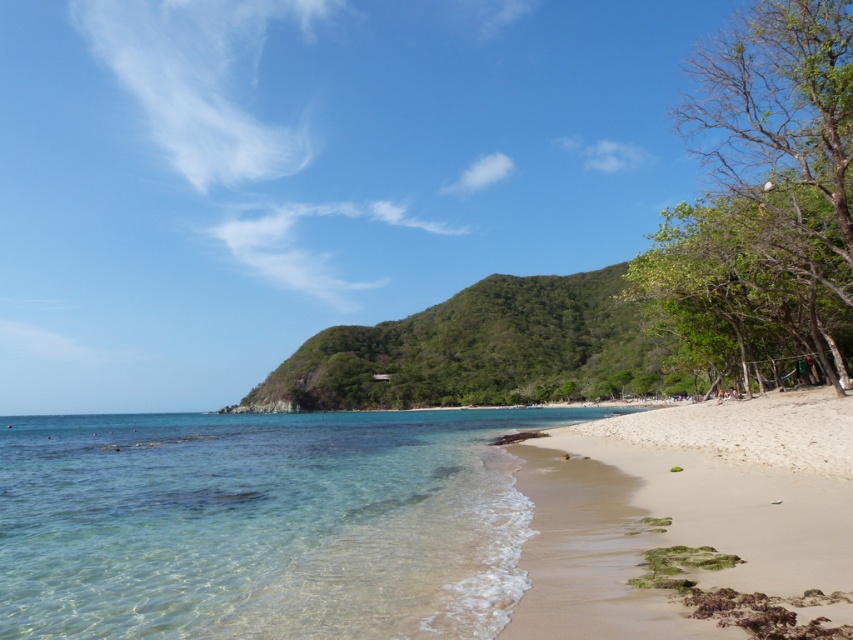
Question: Which object appears farthest from the camera in this image?

Choices:
 (A) white sandy beach at lower right
 (B) sandy beach at lower right

Answer: (A)

Question: Which point appears closest to the camera in this image?

Choices:
 (A) (653, 435)
 (B) (593, 560)
 (C) (383, 436)

Answer: (B)

Question: Which object is farther from the camera taking this photo?

Choices:
 (A) clear water at lower left
 (B) sandy beach at lower right
 (C) white sandy beach at lower right

Answer: (C)

Question: Can you confirm if clear water at lower left is smaller than white sandy beach at lower right?

Choices:
 (A) no
 (B) yes

Answer: (A)

Question: Where is sandy beach at lower right located in relation to white sandy beach at lower right in the image?

Choices:
 (A) above
 (B) below

Answer: (A)

Question: Does clear water at lower left have a greater width compared to white sandy beach at lower right?

Choices:
 (A) no
 (B) yes

Answer: (B)